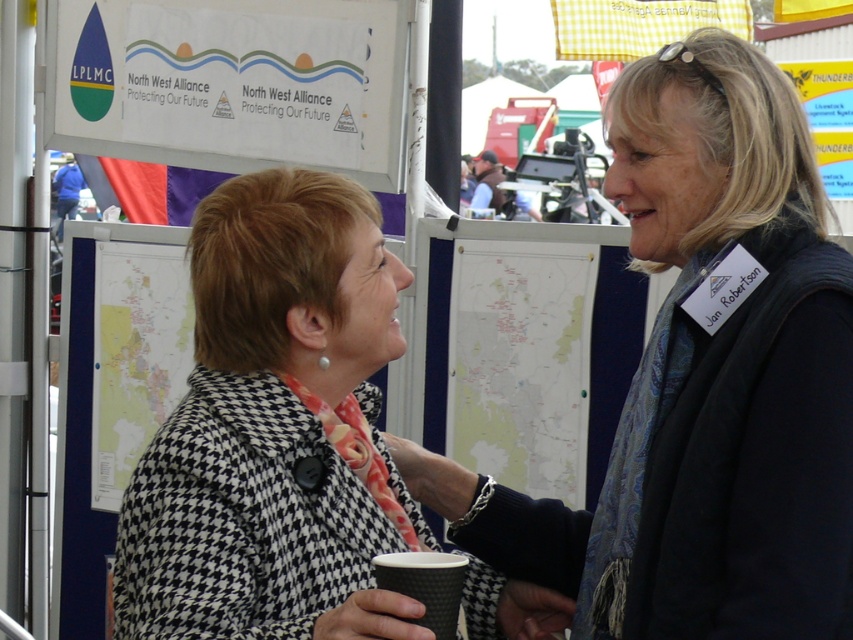
Is houndstooth coat at center thinner than black paper cup at center?

No.

Does point (386, 464) lie in front of point (421, 618)?

No, (386, 464) is behind (421, 618).

Where is `houndstooth coat at center`? This screenshot has width=853, height=640. houndstooth coat at center is located at coordinates (276, 429).

Which is behind, point (711, 54) or point (308, 547)?

Positioned behind is point (711, 54).

Is black houndstooth coat at center shorter than houndstooth coat at center?

No, black houndstooth coat at center is not shorter than houndstooth coat at center.

Does point (761, 228) come closer to viewer compared to point (264, 221)?

No, it is not.

Where is `black houndstooth coat at center`? This screenshot has width=853, height=640. black houndstooth coat at center is located at coordinates (703, 380).

Is point (753, 145) farther from viewer compared to point (450, 605)?

Yes.

Is black houndstooth coat at center above black paper cup at center?

Indeed, black houndstooth coat at center is positioned over black paper cup at center.

This screenshot has height=640, width=853. I want to click on black houndstooth coat at center, so click(x=703, y=380).